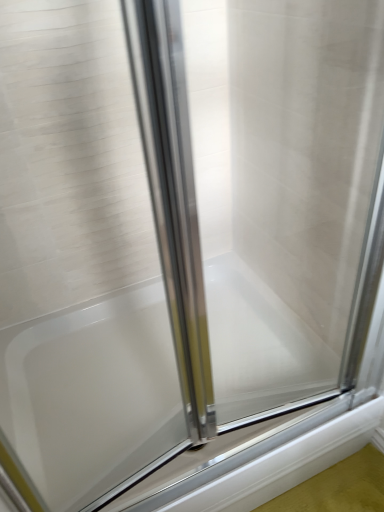
What are the coordinates of `white glossy bathtub at center` in the screenshot? It's located at [92, 395].

What is the approximate height of white glossy bathtub at center?

8.10 inches.

Describe the element at coordinates (92, 395) in the screenshot. I see `white glossy bathtub at center` at that location.

Locate an element on the screen. Image resolution: width=384 pixels, height=512 pixels. white glossy bathtub at center is located at coordinates (92, 395).